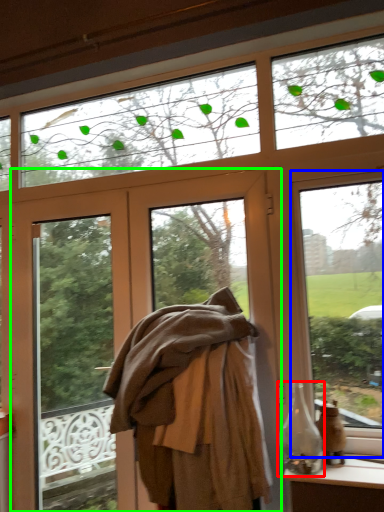
Question: Estimate the real-world distances between objects in this image. Which object is closer to bottle (highlighted by a red box), window (highlighted by a blue box) or door (highlighted by a green box)?

Choices:
 (A) window
 (B) door

Answer: (A)